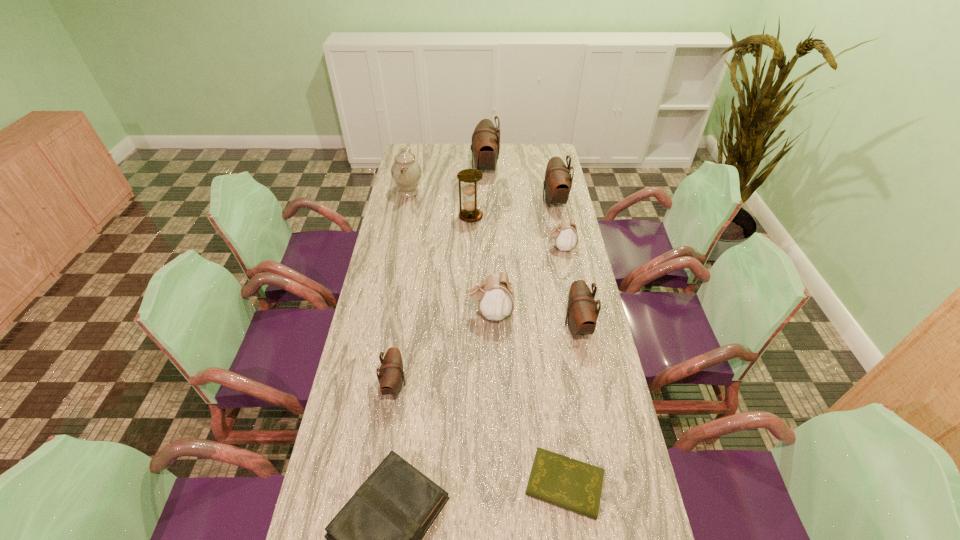
What are the coordinates of `the second brown pouch from left to right` in the screenshot? It's located at (485, 147).

Find the location of a particular element. This screenshot has width=960, height=540. the biggest brown pouch is located at coordinates (485, 147).

Image resolution: width=960 pixels, height=540 pixels. Find the location of `chinaware`. chinaware is located at coordinates (406, 171).

Identify the location of hourglass. The height and width of the screenshot is (540, 960). (469, 177).

What are the coordinates of `the second farthest brown pouch` in the screenshot? It's located at (558, 181).

Identify the location of the third smallest brown pouch. The image size is (960, 540). coord(558,181).

The height and width of the screenshot is (540, 960). In order to click on the nearer white pouch in this screenshot , I will do `click(495, 295)`.

Find the location of a particular element. the bigger white pouch is located at coordinates (495, 295).

The height and width of the screenshot is (540, 960). In order to click on the second smallest brown pouch in this screenshot , I will do `click(582, 313)`.

I want to click on the third farthest pouch, so click(565, 234).